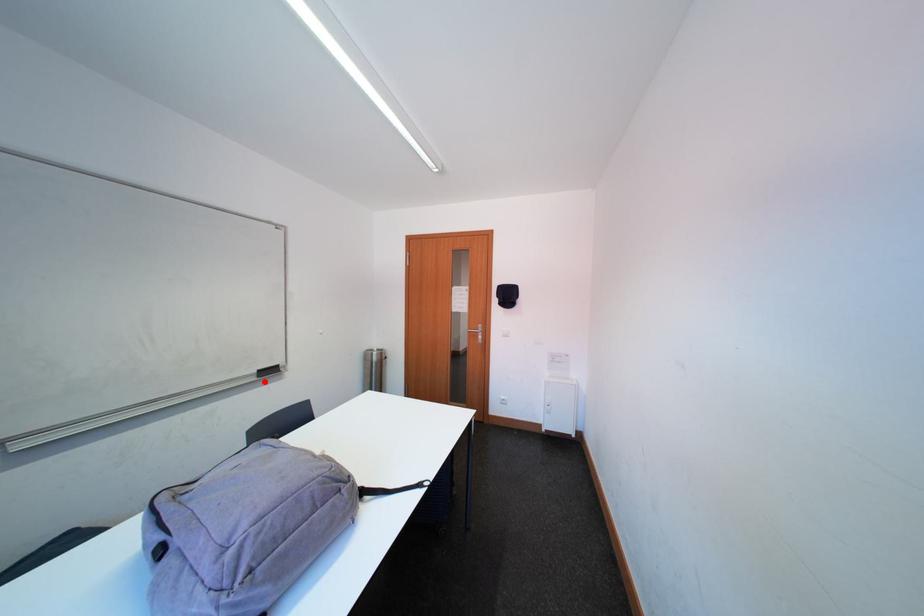
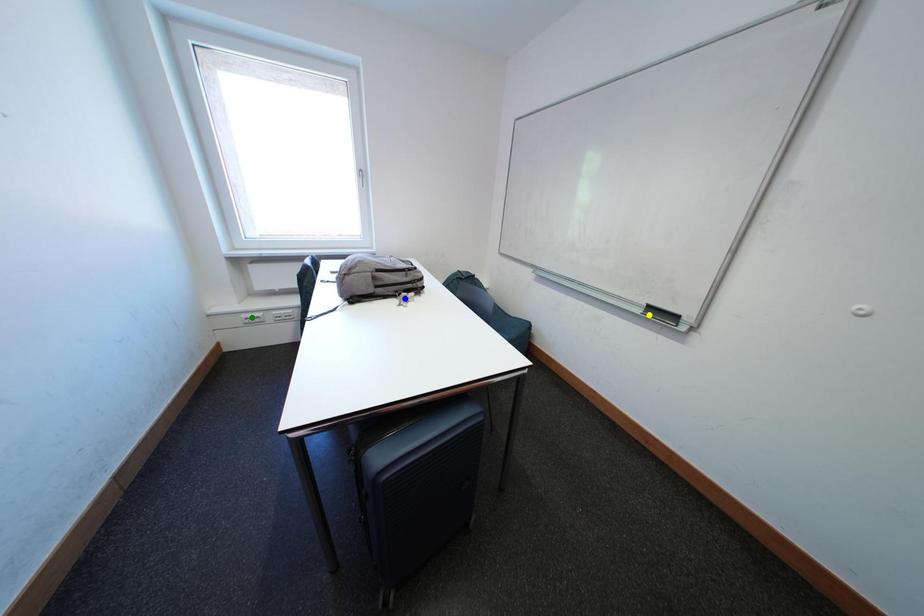
Question: I am providing you with two images of the same scene from different viewpoints. A red point is marked on the first image. You are given multiple points on the second image. In image 2, which mark is for the same physical point as the one in image 1?

Choices:
 (A) blue point
 (B) green point
 (C) yellow point

Answer: (C)